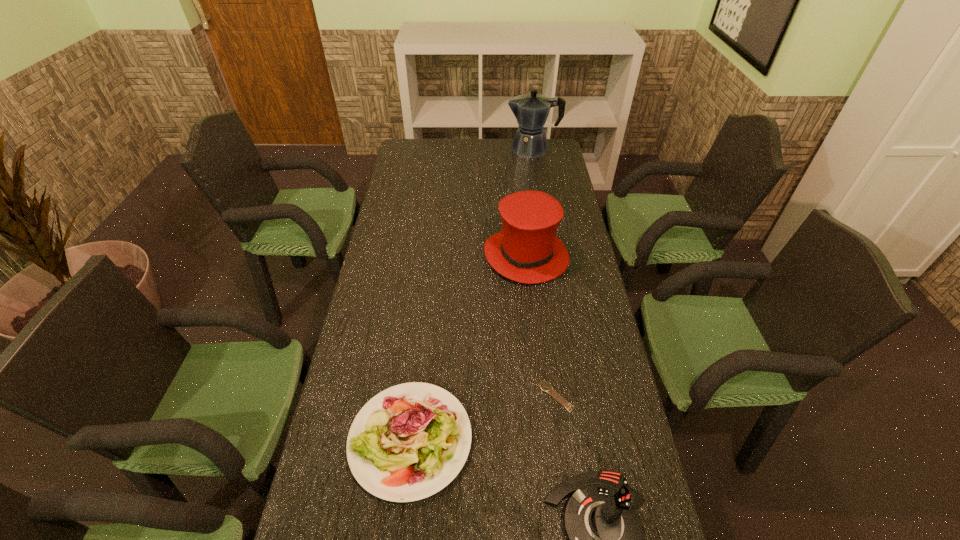
Identify the location of vacant space at the right edge. (553, 340).

Locate an element on the screen. vacant area at the far left corner is located at coordinates (424, 154).

This screenshot has width=960, height=540. I want to click on vacant area that lies between the hat and the shortest object, so click(x=540, y=326).

Where is `free space between the fourth tallest object and the fourth nearest object`? The image size is (960, 540). free space between the fourth tallest object and the fourth nearest object is located at coordinates (468, 348).

Identify the location of free space between the shortest object and the salad plate. The height and width of the screenshot is (540, 960). (483, 418).

Identify the location of vacant point located between the second farthest object and the salad plate. The image size is (960, 540). (468, 348).

At what (x,y) coordinates should I click in order to perform the action: click on vacant area that lies between the shortest object and the fourth nearest object. Please return your answer as a coordinate pair (x, y). Looking at the image, I should click on (540, 326).

Identify the location of free spot between the fourth tallest object and the hat. The image size is (960, 540). (468, 348).

Locate an element on the screen. the fourth closest object relative to the fourth tallest object is located at coordinates (531, 110).

Identify which object is located as the fourth nearest to the fourth nearest object. Please provide its 2D coordinates. Your answer should be formatted as a tuple, i.e. [(x, y)], where the tuple contains the x and y coordinates of a point satisfying the conditions above.

[(604, 532)]